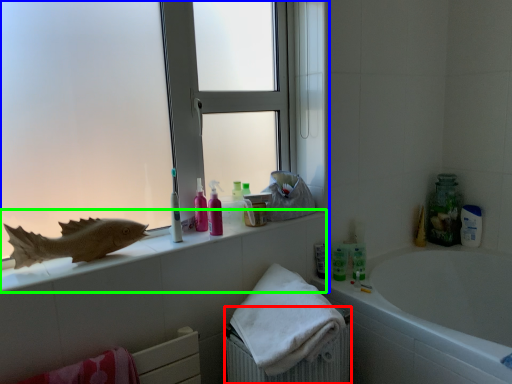
Question: Which object is positioned farthest from radiator (highlighted by a red box)? Select from window (highlighted by a blue box) and counter top (highlighted by a green box).

Choices:
 (A) window
 (B) counter top

Answer: (A)